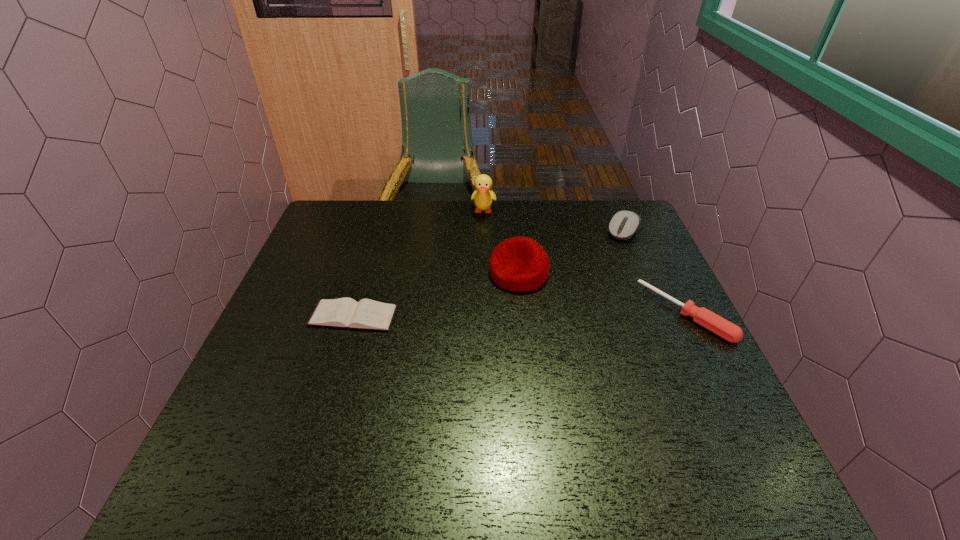
Locate an element on the screen. The width and height of the screenshot is (960, 540). blank region between the computer equipment and the second tallest object is located at coordinates (571, 252).

You are a GUI agent. You are given a task and a screenshot of the screen. Output one action in this format:
    pyautogui.click(x=<x>, y=<y>)
    Task: Click on the free space between the screwdriver and the leftmost object
    This screenshot has height=540, width=960.
    Given the screenshot: What is the action you would take?
    pyautogui.click(x=519, y=315)

Find the location of `vacant space that's between the computer equipment and the diary`. vacant space that's between the computer equipment and the diary is located at coordinates (489, 273).

At what (x,y) coordinates should I click in order to perform the action: click on unoccupied area between the screwdriver and the duckling. Please return your answer as a coordinate pair (x, y). This screenshot has width=960, height=540. Looking at the image, I should click on (585, 262).

Image resolution: width=960 pixels, height=540 pixels. What are the coordinates of `free space between the shortest object and the second shortest object` in the screenshot? It's located at (519, 315).

Identify the location of vacant area that lies between the third tallest object and the beanbag. Image resolution: width=960 pixels, height=540 pixels. (571, 252).

Where is `vacant space in between the beanbag and the screwdriver`? vacant space in between the beanbag and the screwdriver is located at coordinates (602, 293).

In order to click on free spot between the third shortest object and the shortest object in this screenshot , I will do `click(489, 273)`.

You are a GUI agent. You are given a task and a screenshot of the screen. Output one action in this format:
    pyautogui.click(x=<x>, y=<y>)
    Task: Click on the object that can be found as the closest to the beanbag
    This screenshot has height=540, width=960.
    Given the screenshot: What is the action you would take?
    (483, 197)

Where is `the second closest object to the leftmost object`? The image size is (960, 540). the second closest object to the leftmost object is located at coordinates [483, 197].